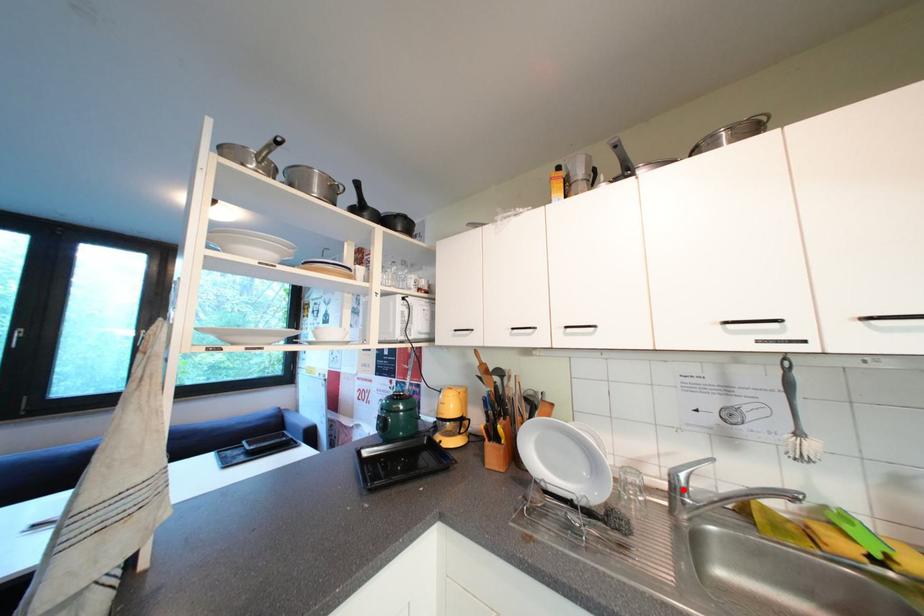
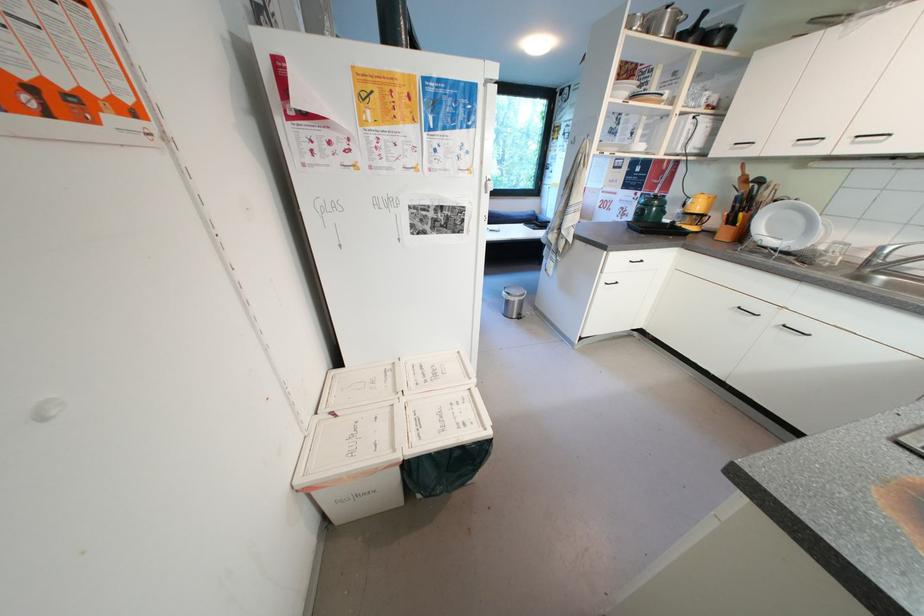
Question: I am providing you with two images of the same scene from different viewpoints. In image1, a red point is highlighted. Considering the same 3D point in image2, which of the following is correct?

Choices:
 (A) It is closer
 (B) It is farther

Answer: (B)